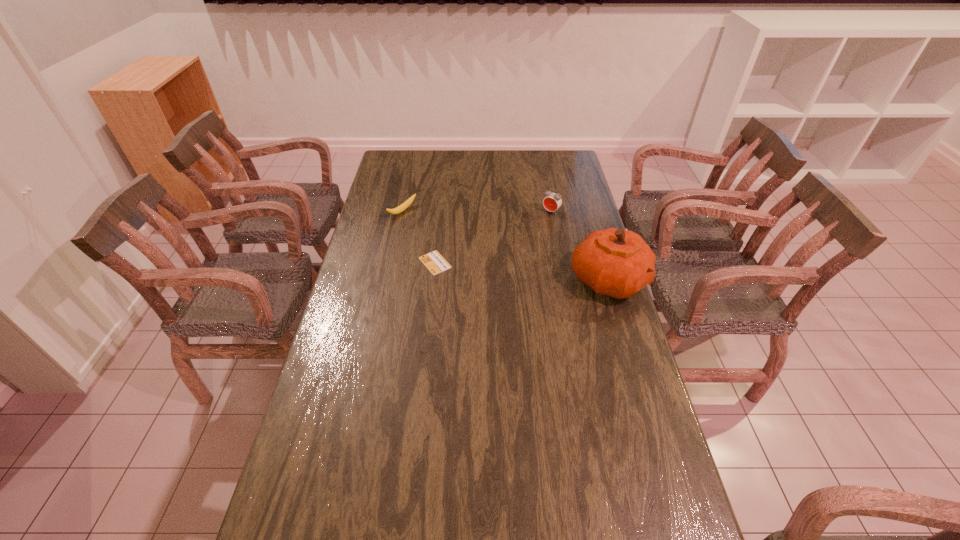
The height and width of the screenshot is (540, 960). In order to click on vacant spot on the desktop that is between the shortest object and the tallest object and is positioned on the face of the alarm clock in this screenshot , I will do `click(501, 269)`.

Locate an element on the screen. The image size is (960, 540). vacant spot on the desktop that is between the shortest object and the tallest object and is positioned on the upward curve of the banana is located at coordinates (505, 269).